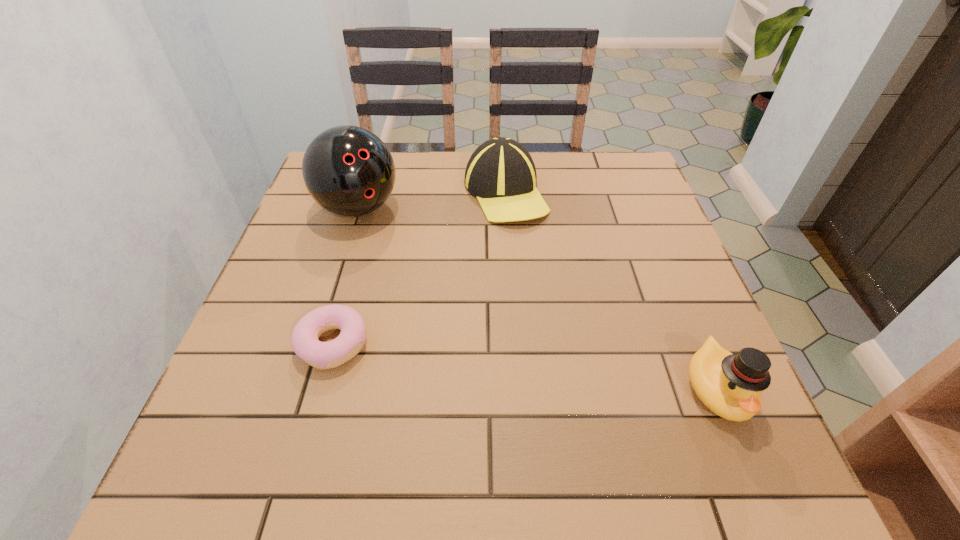
You are a GUI agent. You are given a task and a screenshot of the screen. Output one action in this format:
    pyautogui.click(x=<x>, y=<y>)
    Task: Click on the vacant area at the left edge
    The width and height of the screenshot is (960, 540).
    Given the screenshot: What is the action you would take?
    pyautogui.click(x=335, y=268)

Find the location of a particular element. The width and height of the screenshot is (960, 540). free space at the right edge of the desktop is located at coordinates (672, 256).

In the image, there is a desktop. Where is `vacant area at the far right corner`? Image resolution: width=960 pixels, height=540 pixels. vacant area at the far right corner is located at coordinates (643, 197).

You are a GUI agent. You are given a task and a screenshot of the screen. Output one action in this format:
    pyautogui.click(x=<x>, y=<y>)
    Task: Click on the empty location between the third object from left to right and the tallest object
    
    Given the screenshot: What is the action you would take?
    pyautogui.click(x=432, y=201)

Find the location of `vacant space that's between the doughnut and the bowling ball`. vacant space that's between the doughnut and the bowling ball is located at coordinates (346, 276).

At what (x,y) coordinates should I click in order to perform the action: click on vacant area that lies between the bowling ball and the second object from right to left. Please return your answer as a coordinate pair (x, y). Looking at the image, I should click on (432, 201).

Identify the location of free spot between the doughnut and the tallest object. Image resolution: width=960 pixels, height=540 pixels. (346, 276).

Identify the location of free spot between the second object from right to left and the duck. Image resolution: width=960 pixels, height=540 pixels. (612, 291).

Locate an element on the screen. This screenshot has width=960, height=540. free area in between the tallest object and the doughnut is located at coordinates (346, 276).

Locate an element on the screen. The image size is (960, 540). free space between the third object from left to right and the rightmost object is located at coordinates (612, 291).